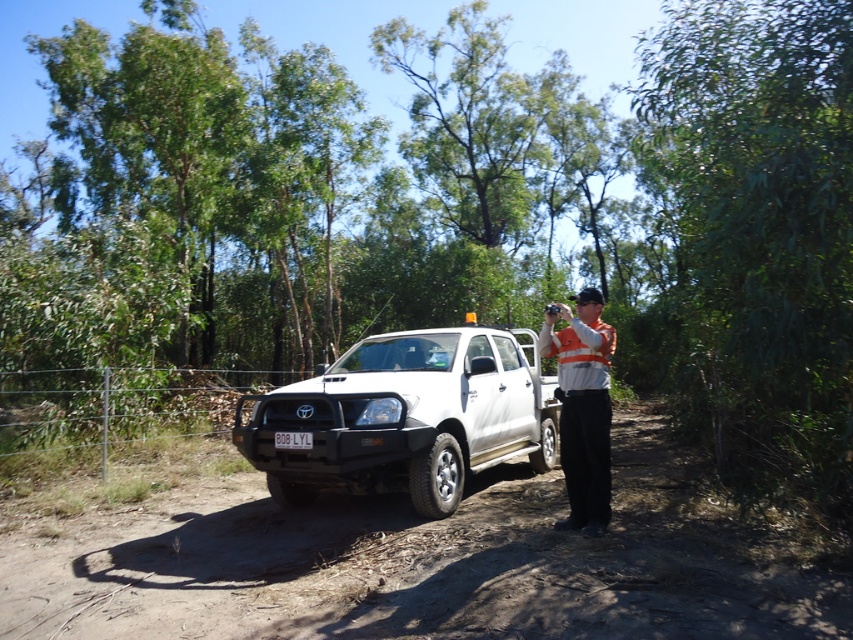
Question: Which object is positioned closest to the orange reflective vest at center?

Choices:
 (A) white plastic license plate at center
 (B) white matte truck at center

Answer: (A)

Question: Based on their relative distances, which object is farther from the dirt field at center?

Choices:
 (A) white plastic license plate at center
 (B) white matte truck at center

Answer: (B)

Question: Can you confirm if orange reflective vest at center is positioned above white plastic license plate at center?

Choices:
 (A) yes
 (B) no

Answer: (A)

Question: Is orange reflective vest at center thinner than white plastic license plate at center?

Choices:
 (A) no
 (B) yes

Answer: (A)

Question: Which object is positioned closest to the white plastic license plate at center?

Choices:
 (A) orange reflective vest at center
 (B) white matte truck at center

Answer: (B)

Question: Does dirt field at center have a larger size compared to white matte truck at center?

Choices:
 (A) no
 (B) yes

Answer: (A)